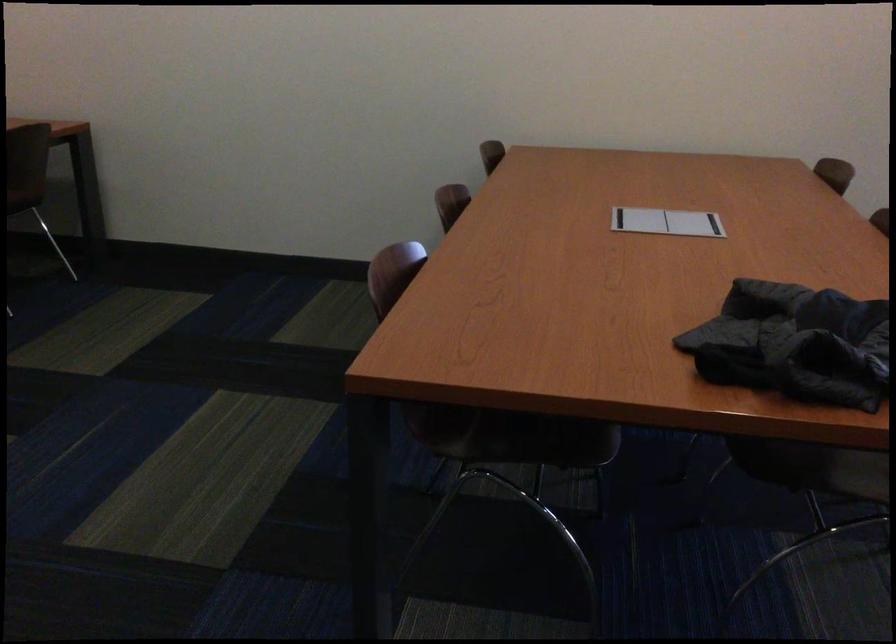
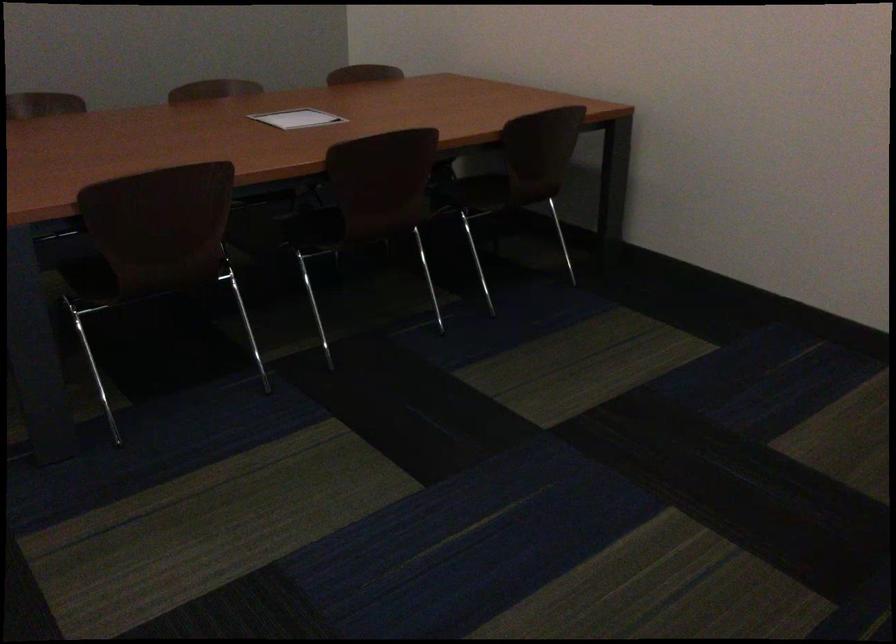
Question: How did the camera likely rotate?

Choices:
 (A) Left
 (B) Right
 (C) Up
 (D) Down

Answer: (A)